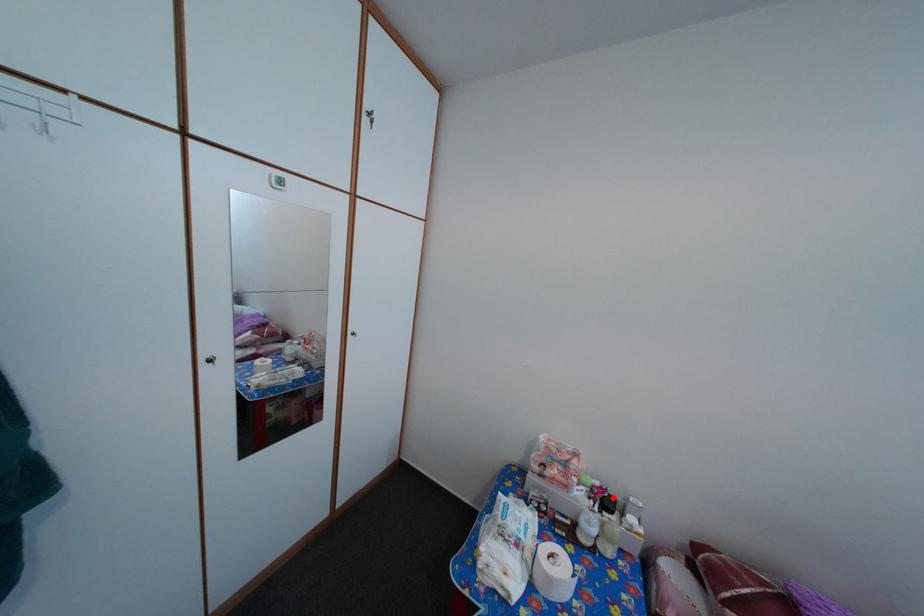
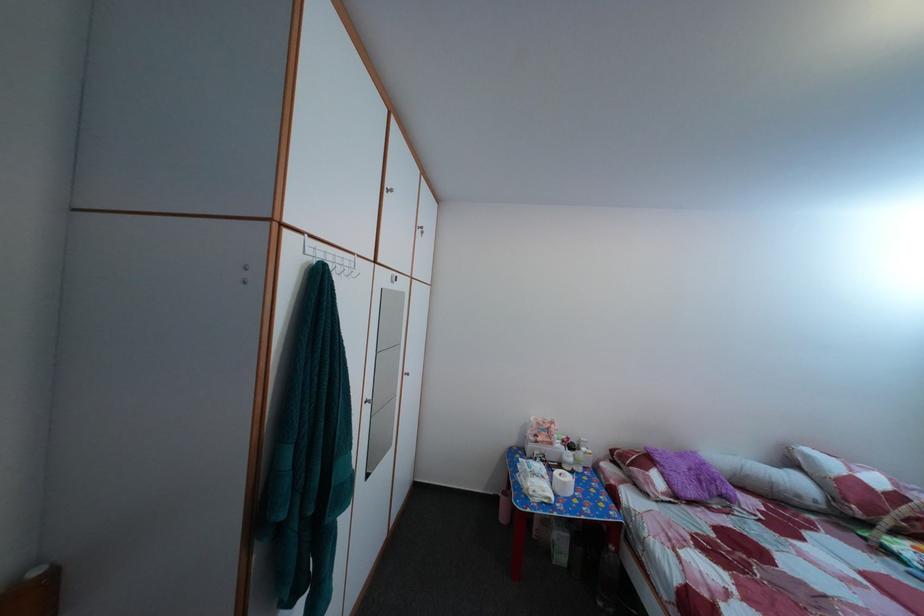
Where in the second image is the point corresponding to the highlighted location from the first image?

(578, 447)